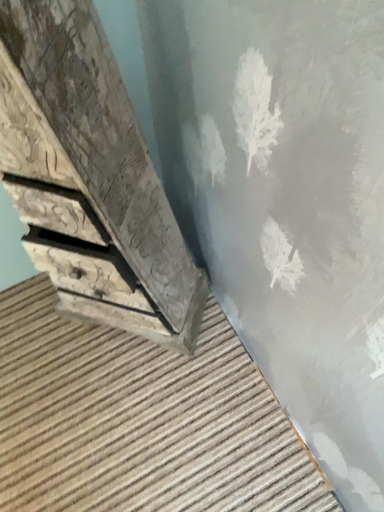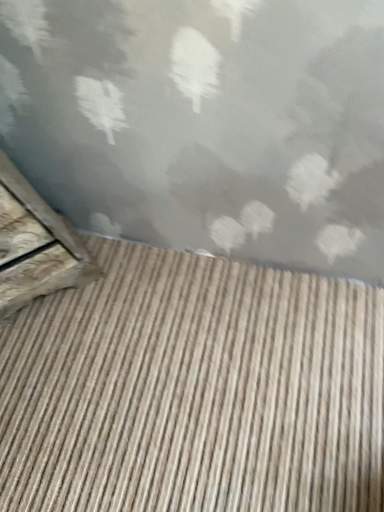
Question: Which way did the camera rotate in the video?

Choices:
 (A) rotated upward
 (B) rotated downward

Answer: (A)